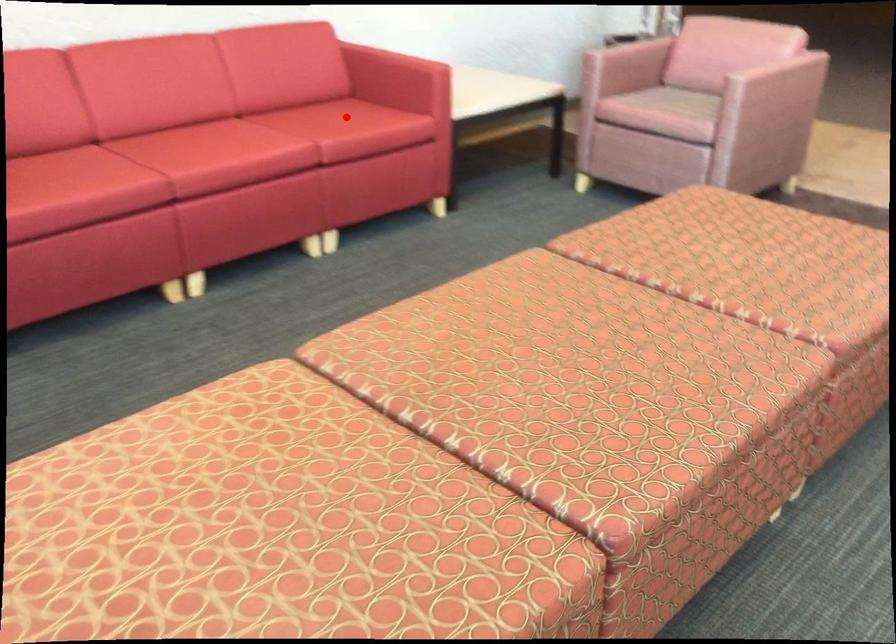
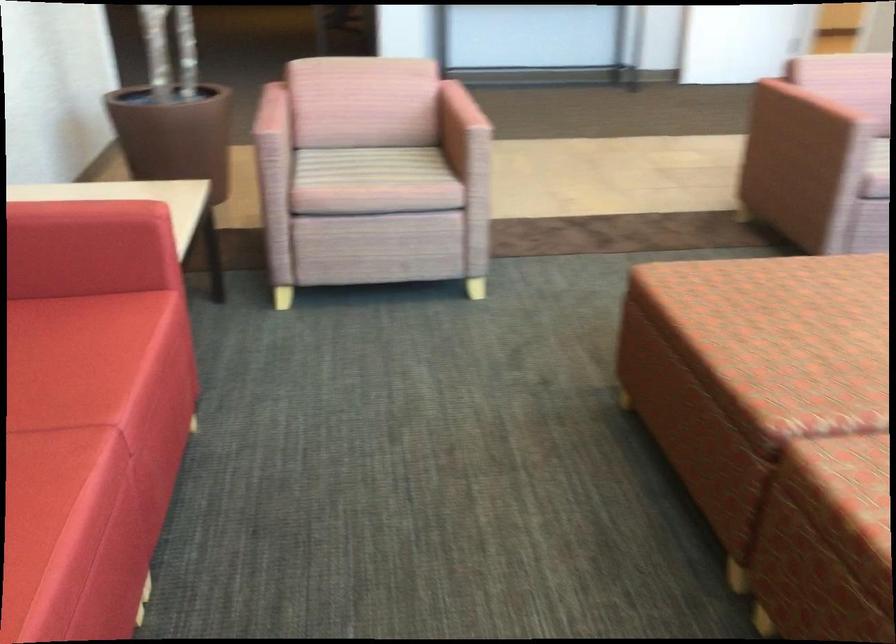
The point at the highlighted location is marked in the first image. Where is the corresponding point in the second image?

(69, 360)